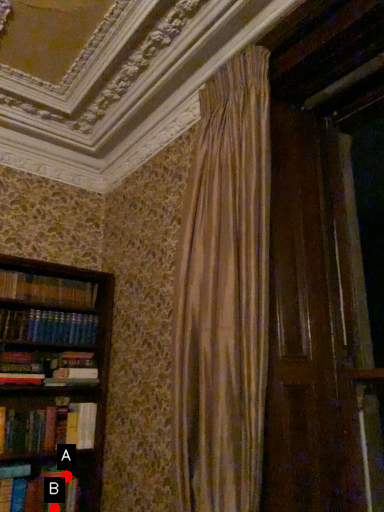
Question: Two points are circled on the image, labeled by A and B beside each circle. Which point is closer to the camera?

Choices:
 (A) A is closer
 (B) B is closer

Answer: (B)